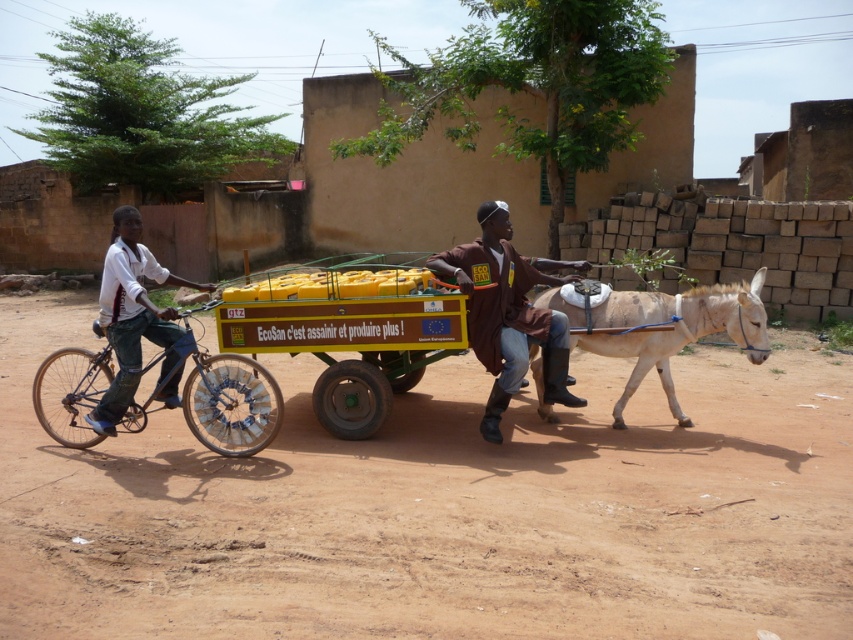
Is brown leather jacket at center shorter than white shirt at left?

In fact, brown leather jacket at center may be taller than white shirt at left.

Is brown leather jacket at center to the left of white shirt at left from the viewer's perspective?

In fact, brown leather jacket at center is to the right of white shirt at left.

Find the location of `brown leather jacket at center`. brown leather jacket at center is located at coordinates (506, 314).

This screenshot has width=853, height=640. Identify the location of brown leather jacket at center. (506, 314).

Is brown dirt field at center smaller than brown leather jacket at center?

Actually, brown dirt field at center might be larger than brown leather jacket at center.

Can you confirm if brown dirt field at center is wider than brown leather jacket at center?

Yes.

At what (x,y) coordinates should I click in order to perform the action: click on brown dirt field at center. Please return your answer as a coordinate pair (x, y). The image size is (853, 640). Looking at the image, I should click on (439, 508).

At what (x,y) coordinates should I click in order to perform the action: click on brown dirt field at center. Please return your answer as a coordinate pair (x, y). Looking at the image, I should click on (439, 508).

Between light brown leather donkey at center and white shirt at left, which one is positioned lower?

light brown leather donkey at center is below.

Is light brown leather donkey at center in front of white shirt at left?

No, light brown leather donkey at center is further to the viewer.

This screenshot has width=853, height=640. What are the coordinates of `light brown leather donkey at center` in the screenshot? It's located at click(x=675, y=330).